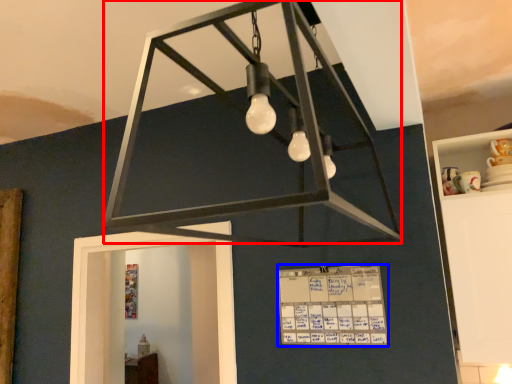
Question: Which object is further to the camera taking this photo, lamp (highlighted by a red box) or writing (highlighted by a blue box)?

Choices:
 (A) lamp
 (B) writing

Answer: (B)